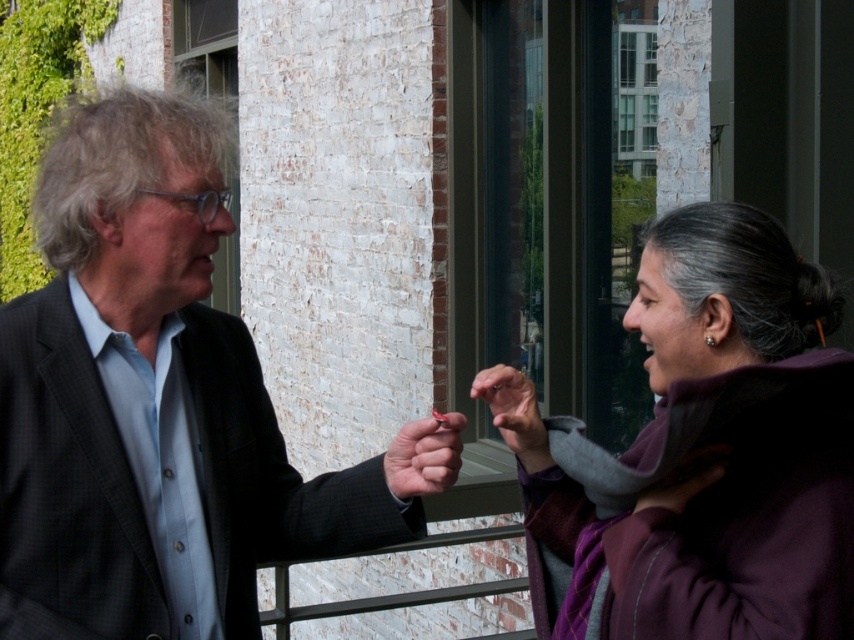
Between purple woolen scarf at right and matte gray hand at center, which one has less height?

Standing shorter between the two is matte gray hand at center.

Can you confirm if purple woolen scarf at right is positioned to the right of matte gray hand at center?

Correct, you'll find purple woolen scarf at right to the right of matte gray hand at center.

Which is in front, point (753, 609) or point (521, 429)?

Positioned in front is point (753, 609).

Find the location of a particular element. The height and width of the screenshot is (640, 854). purple woolen scarf at right is located at coordinates (709, 456).

Is matte black suit at left further to camera compared to purple woolen scarf at right?

Yes, it is behind purple woolen scarf at right.

Is point (33, 317) more distant than point (703, 275)?

Yes, it is behind point (703, 275).

At what (x,y) coordinates should I click in order to perform the action: click on matte black suit at left. Please return your answer as a coordinate pair (x, y). This screenshot has height=640, width=854. Looking at the image, I should click on (149, 403).

Who is shorter, matte black hand at center or matte gray hand at center?

Standing shorter between the two is matte black hand at center.

Which is behind, point (389, 472) or point (525, 445)?

The point (389, 472) is more distant.

The width and height of the screenshot is (854, 640). Find the location of `matte black hand at center`. matte black hand at center is located at coordinates click(424, 456).